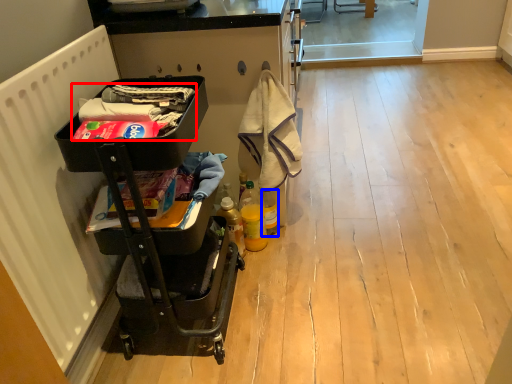
Question: Which object is further to the camera taking this photo, laundry (highlighted by a red box) or bottle (highlighted by a blue box)?

Choices:
 (A) laundry
 (B) bottle

Answer: (B)